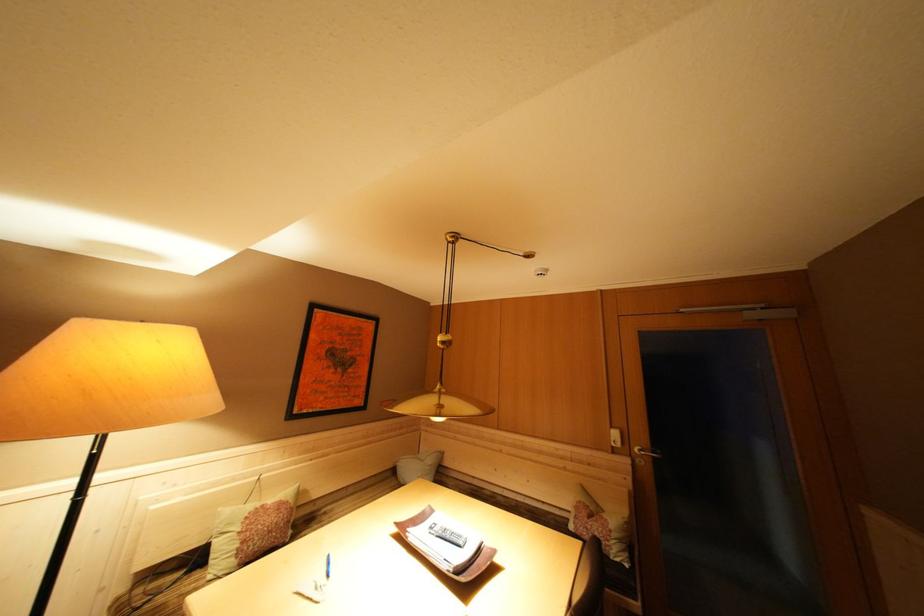
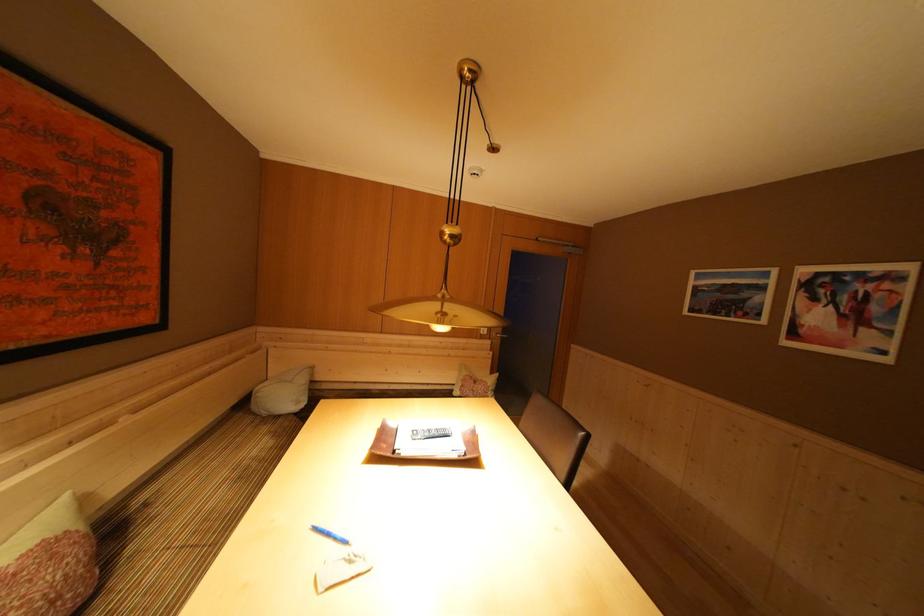
The images are taken continuously from a first-person perspective. In which direction is your viewpoint rotating?

The rotation direction of the camera is right-down.